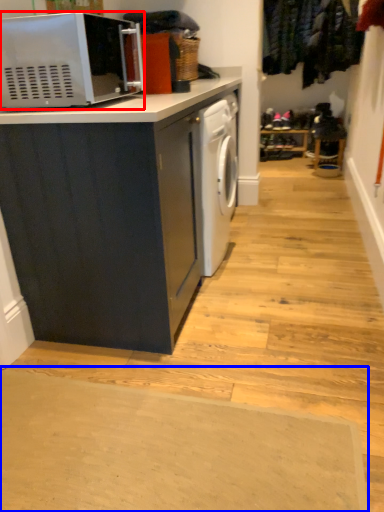
Question: Which object is closer to the camera taking this photo, microwave oven (highlighted by a red box) or doormat (highlighted by a blue box)?

Choices:
 (A) microwave oven
 (B) doormat

Answer: (B)